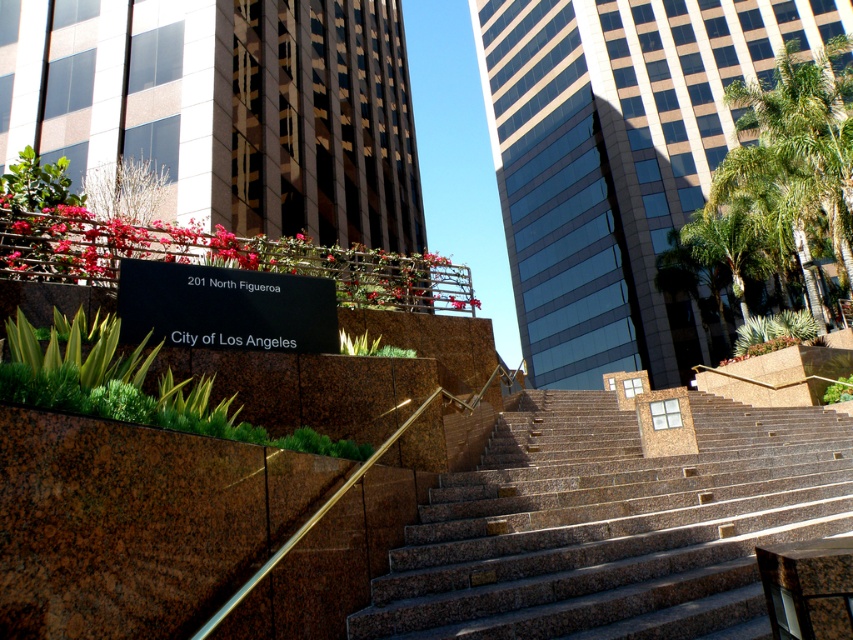
Based on the photo, who is lower down, brown granite stairs at center or green leafy palm tree at upper right?

Positioned lower is brown granite stairs at center.

Does point (769, 529) come behind point (747, 115)?

No.

The height and width of the screenshot is (640, 853). What are the coordinates of `brown granite stairs at center` in the screenshot? It's located at (613, 524).